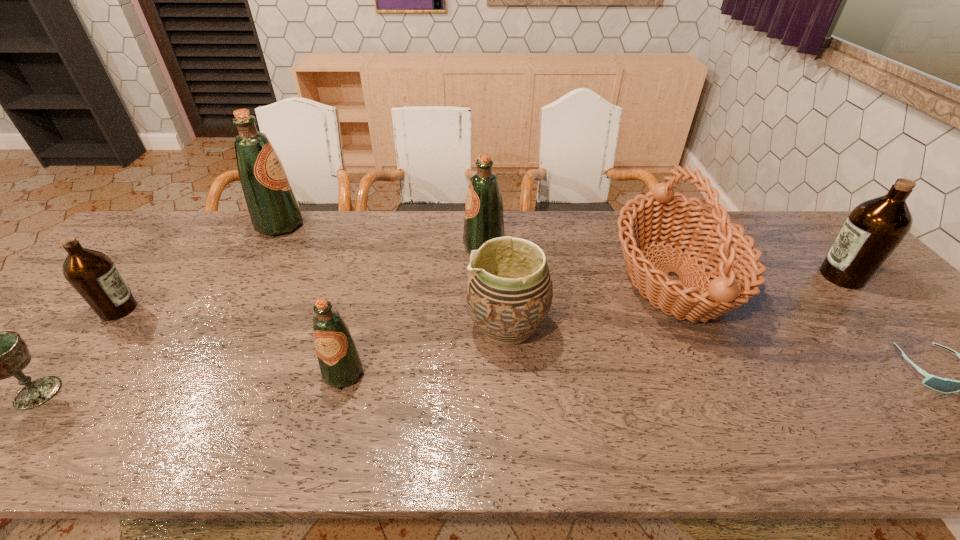
You are a GUI agent. You are given a task and a screenshot of the screen. Output one action in this format:
    pyautogui.click(x=<x>, y=<y>)
    Task: Click on the vacant region that satisfies the following two spatial constraints: 1. on the back side of the basket; 2. on the front-facing side of the tallest olive oil
    The height and width of the screenshot is (540, 960).
    Given the screenshot: What is the action you would take?
    pyautogui.click(x=646, y=225)

Image resolution: width=960 pixels, height=540 pixels. I want to click on free space that satisfies the following two spatial constraints: 1. on the front-facing side of the third object from right to left; 2. on the right side of the second biggest green olive oil, so pos(484,279).

Where is `vacant space that satisfies the following two spatial constraints: 1. on the label of the farther brown olive oil; 2. on the front side of the basket`? This screenshot has height=540, width=960. vacant space that satisfies the following two spatial constraints: 1. on the label of the farther brown olive oil; 2. on the front side of the basket is located at coordinates (844, 279).